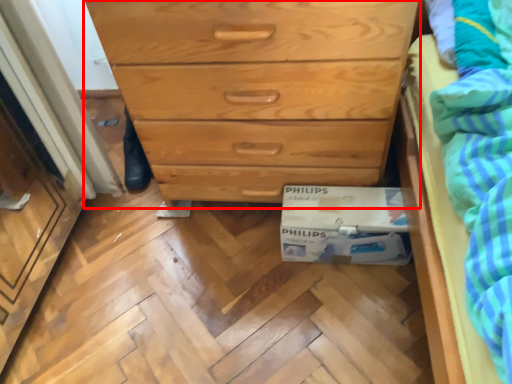
Question: Observing the image, what is the correct spatial positioning of chest of drawers (annotated by the red box) in reference to cardboard box?

Choices:
 (A) left
 (B) right

Answer: (A)